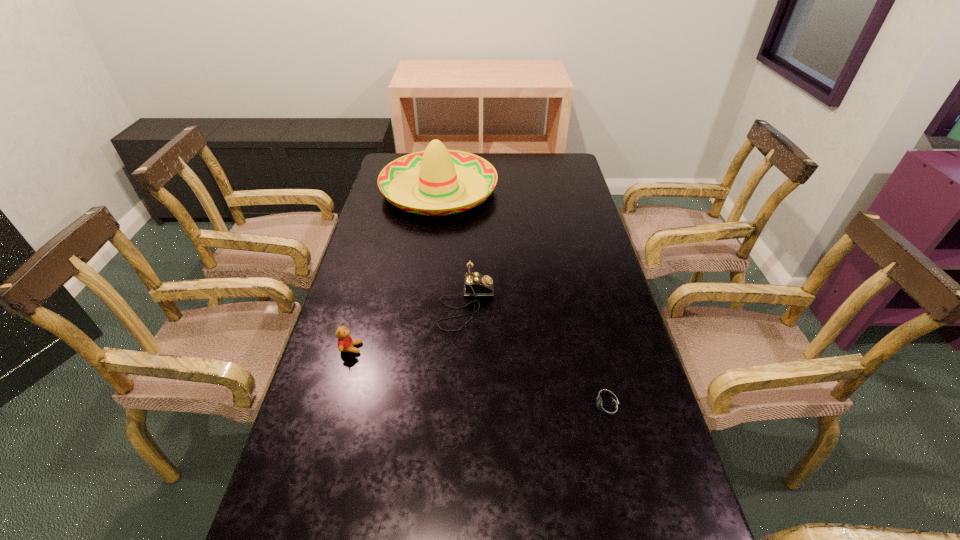
At what (x,y) coordinates should I click in order to perform the action: click on empty location between the tallest object and the teddy bear. Please return your answer as a coordinate pair (x, y). This screenshot has width=960, height=540. Looking at the image, I should click on (395, 269).

Locate an element on the screen. The image size is (960, 540). object that is the second closest to the teddy bear is located at coordinates (437, 170).

Select which object is the closest to the third farthest object. Please provide its 2D coordinates. Your answer should be formatted as a tuple, i.e. [(x, y)], where the tuple contains the x and y coordinates of a point satisfying the conditions above.

[(476, 284)]